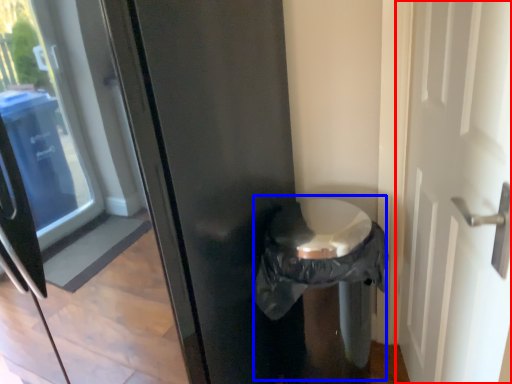
Question: Which point is further to the camera, door (highlighted by a red box) or garbage (highlighted by a blue box)?

Choices:
 (A) door
 (B) garbage

Answer: (B)